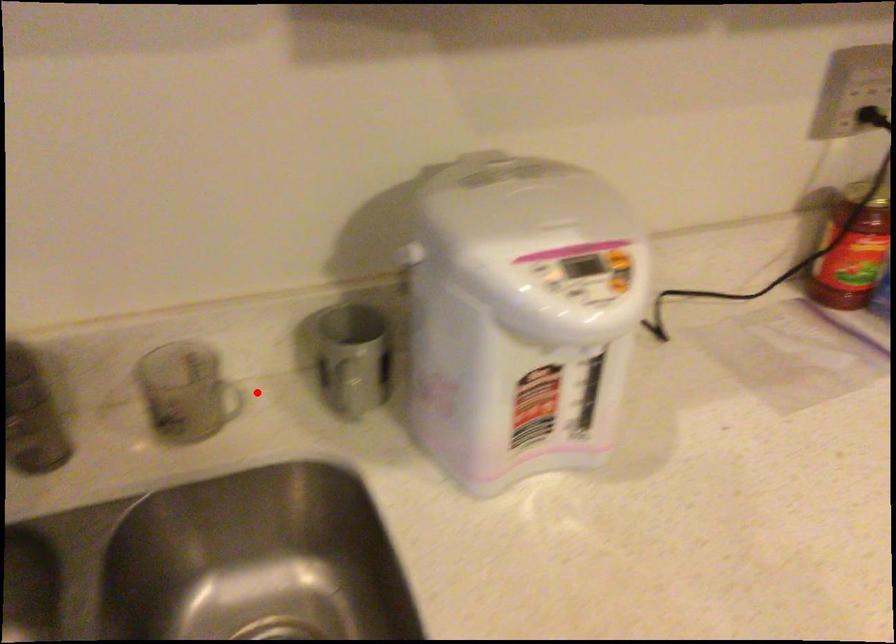
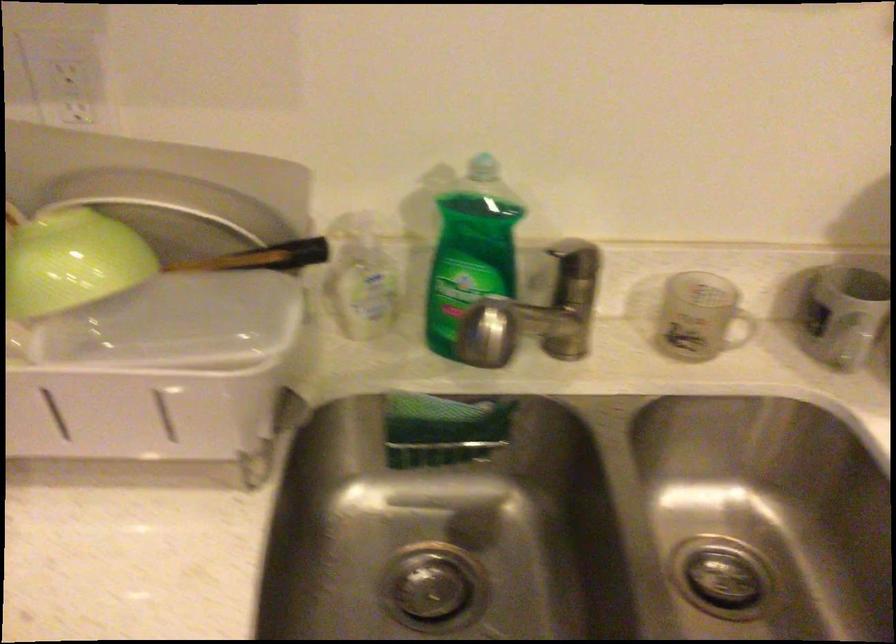
In the second image, find the point that corresponds to the highlighted location in the first image.

(739, 328)